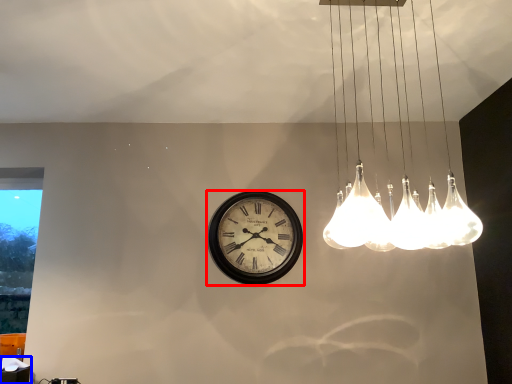
Question: Which of the following is the closest to the observer, wall clock (highlighted by a red box) or table (highlighted by a blue box)?

Choices:
 (A) wall clock
 (B) table

Answer: (B)